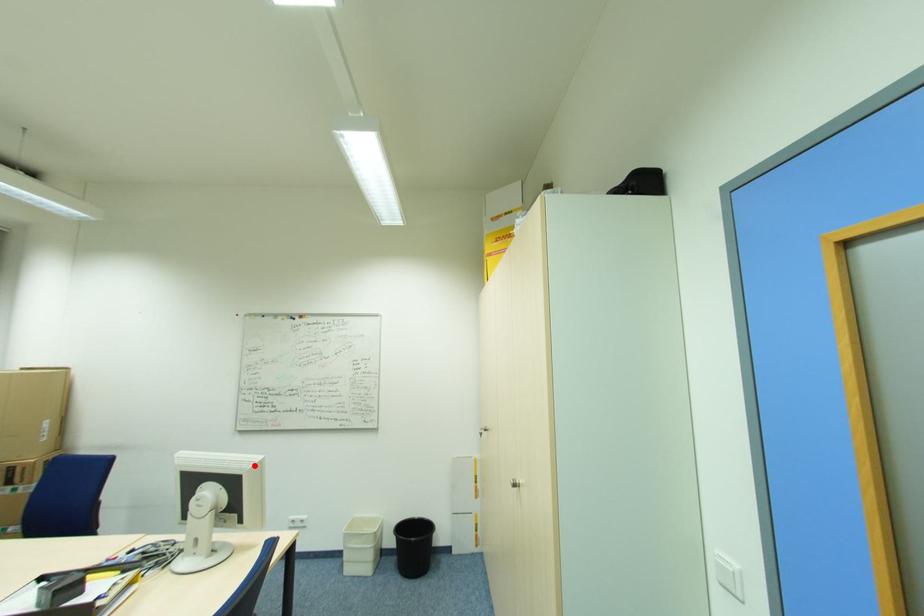
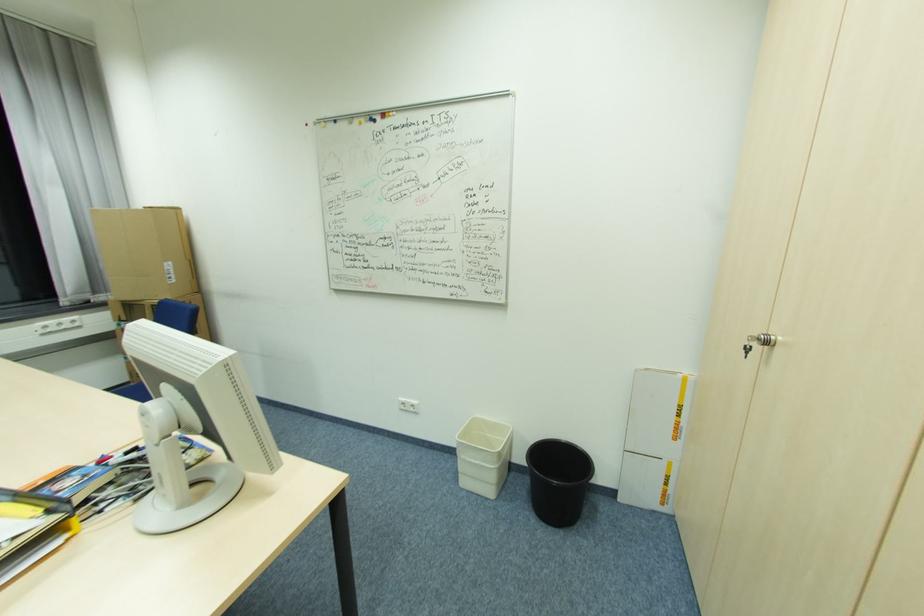
Locate, in the second image, the point that corresponds to the highlighted location in the first image.

(207, 371)